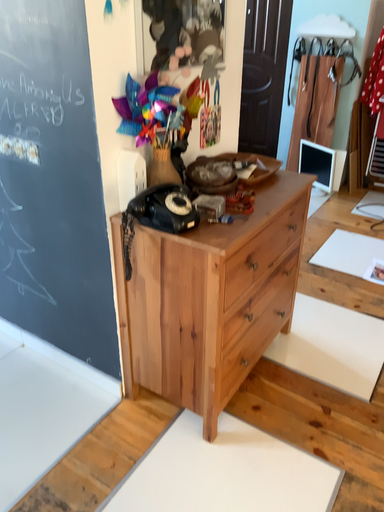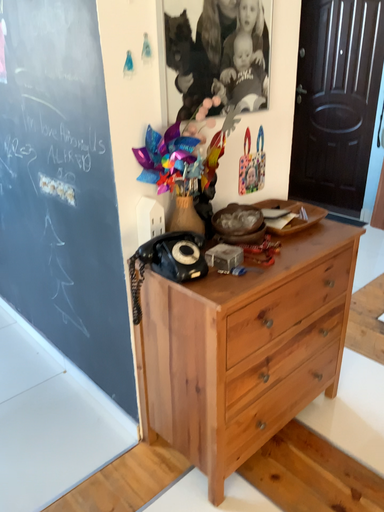
Question: Which way did the camera rotate in the video?

Choices:
 (A) rotated right
 (B) rotated left

Answer: (B)